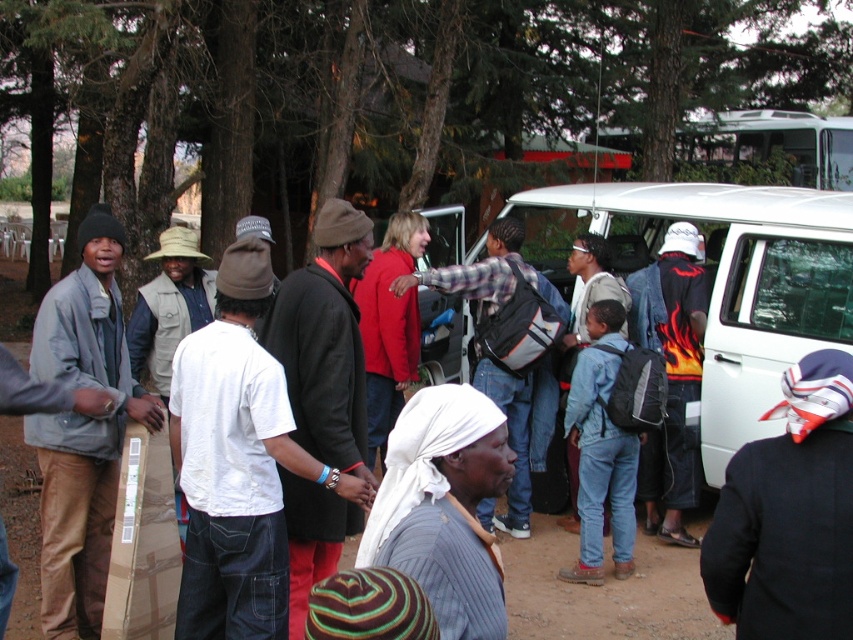
Does matte gray jacket at left come in front of plaid fabric shirt at center?

Yes, matte gray jacket at left is in front of plaid fabric shirt at center.

Is matte gray jacket at left wider than plaid fabric shirt at center?

Incorrect, matte gray jacket at left's width does not surpass plaid fabric shirt at center's.

Which is in front, point (97, 444) or point (514, 509)?

Positioned in front is point (97, 444).

Where is `matte gray jacket at left`? This screenshot has height=640, width=853. matte gray jacket at left is located at coordinates (82, 429).

Which is behind, point (721, 476) or point (666, 337)?

Positioned behind is point (666, 337).

Between white matte van at center and flame-patterned shirt at center-right, which one is positioned lower?

flame-patterned shirt at center-right is lower down.

You are a GUI agent. You are given a task and a screenshot of the screen. Output one action in this format:
    pyautogui.click(x=<x>, y=<y>)
    Task: Click on the white matte van at center
    
    Given the screenshot: What is the action you would take?
    pyautogui.click(x=720, y=280)

Where is `white matte van at center`? white matte van at center is located at coordinates (720, 280).

Can you confirm if flame-patterned shirt at center-right is positioned to the right of plaid fabric shirt at center?

Correct, you'll find flame-patterned shirt at center-right to the right of plaid fabric shirt at center.

Does flame-patterned shirt at center-right have a lesser height compared to plaid fabric shirt at center?

No, flame-patterned shirt at center-right is not shorter than plaid fabric shirt at center.

Measure the distance between point (659, 461) and camera.

Point (659, 461) and camera are 6.10 meters apart from each other.

I want to click on flame-patterned shirt at center-right, so click(671, 376).